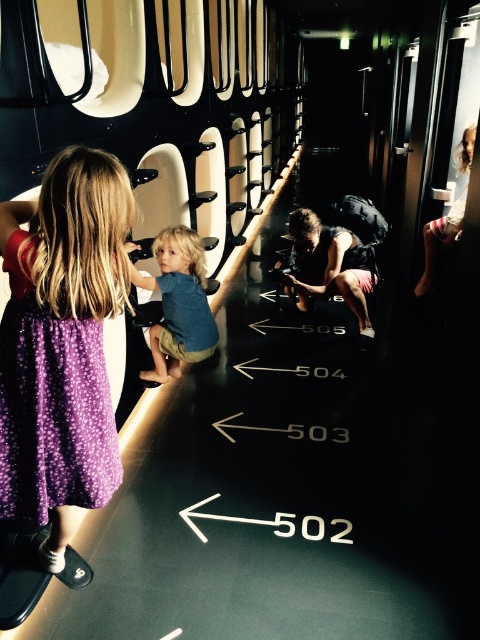
Does purple dotted dress at left have a greater height compared to blue cotton shirt at center?

Yes, purple dotted dress at left is taller than blue cotton shirt at center.

Between point (81, 358) and point (154, 328), which one is positioned behind?

The point (154, 328) is more distant.

Identify the location of purple dotted dress at left. The image size is (480, 640). (61, 344).